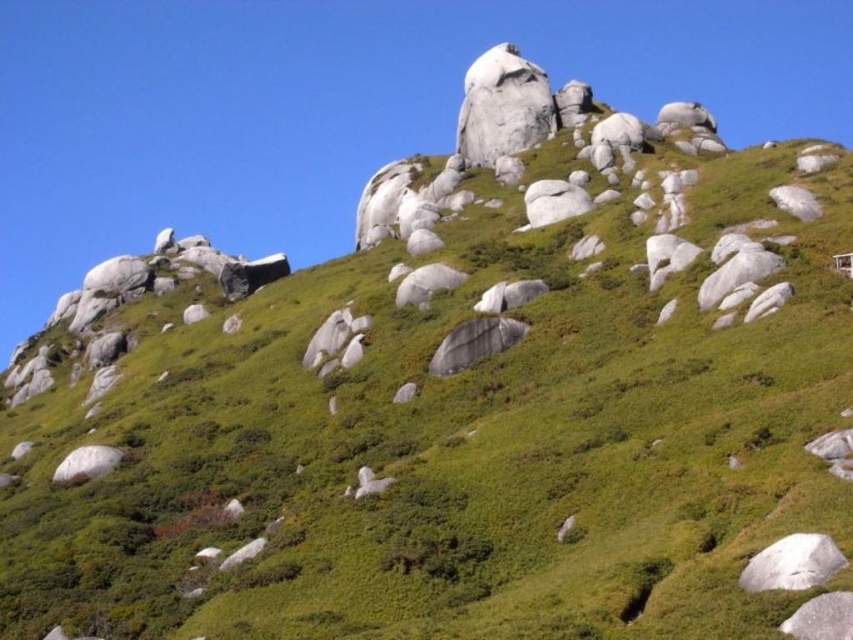
You are standing on the rugged hillside and want to place a flag at the point that is closer to you. Which point should you choose between point (482, 349) and point (809, 609)?

Point (809, 609) is closer to you, so you should place the flag there.

You are a hiker trying to climb up the hillside. You see the white smooth rock at lower right and the smooth gray rock at lower right. Which rock should you step on first to reach the top more easily?

The white smooth rock at lower right has a greater height compared to the smooth gray rock at lower right, so stepping on the white smooth rock at lower right first would provide a better elevation gain and make climbing easier.

You are a hiker standing at the bottom of the hillside. You notice a gray matte rock at center. Can you determine its exact position on the slope using the coordinate system provided?

The gray matte rock at center is located at point (474,342), which means it is positioned slightly to the right and above the center of the slope.